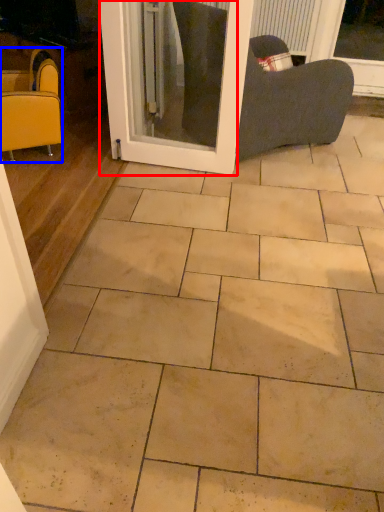
Question: Which of the following is the farthest to the observer, screen door (highlighted by a red box) or chair (highlighted by a blue box)?

Choices:
 (A) screen door
 (B) chair

Answer: (B)